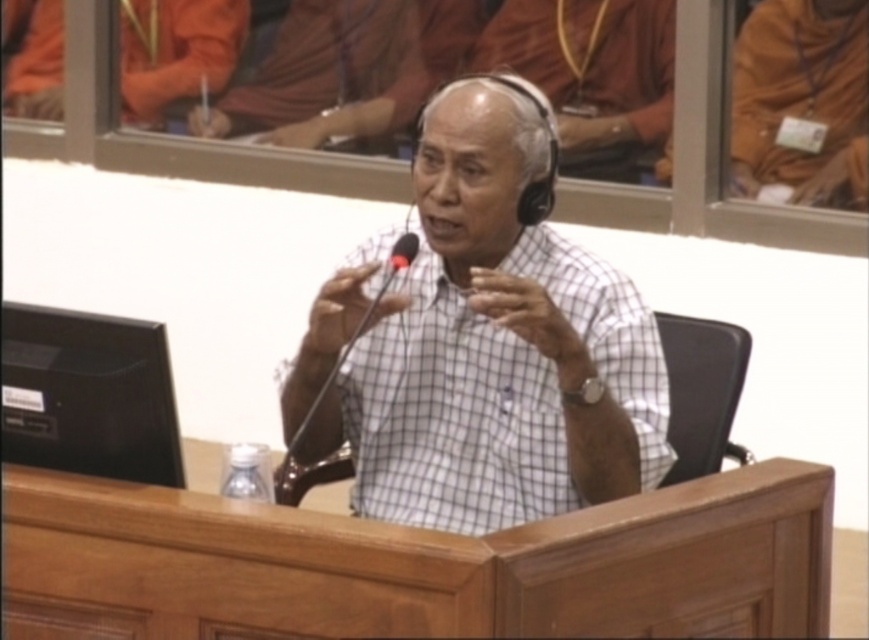
From the picture: You are a sound technician adjusting the microphone placement for a speaker. The speaker is wearing a white checkered shirt at center and has a black matte microphone at center. From the speaker perspective, which item is closer to their face?

The white checkered shirt at center is in front of the black matte microphone at center, so from the speaker perspective, the white checkered shirt at center is closer to their face.